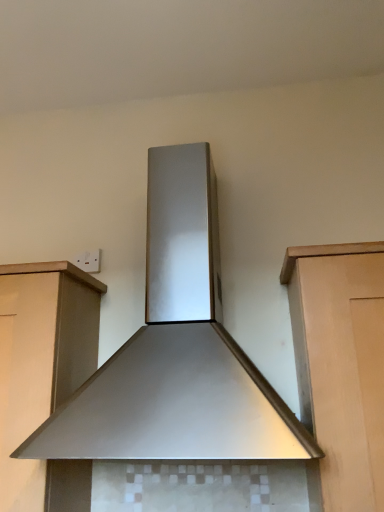
Question: Does matte wood cabinet at left come in front of stainless steel range hood at center?

Choices:
 (A) no
 (B) yes

Answer: (A)

Question: Would you say matte wood cabinet at left is outside stainless steel range hood at center?

Choices:
 (A) no
 (B) yes

Answer: (B)

Question: Is matte wood cabinet at left smaller than stainless steel range hood at center?

Choices:
 (A) no
 (B) yes

Answer: (B)

Question: Does matte wood cabinet at left have a greater height compared to stainless steel range hood at center?

Choices:
 (A) yes
 (B) no

Answer: (B)

Question: Is matte wood cabinet at left shorter than stainless steel range hood at center?

Choices:
 (A) yes
 (B) no

Answer: (A)

Question: Is stainless steel range hood at center at the back of matte wood cabinet at left?

Choices:
 (A) no
 (B) yes

Answer: (A)

Question: Are stainless steel range hood at center and matte wood cabinet at left beside each other?

Choices:
 (A) yes
 (B) no

Answer: (B)

Question: Is stainless steel range hood at center shorter than matte wood cabinet at left?

Choices:
 (A) no
 (B) yes

Answer: (A)

Question: Is stainless steel range hood at center bigger than matte wood cabinet at left?

Choices:
 (A) yes
 (B) no

Answer: (A)

Question: Can we say stainless steel range hood at center lies outside matte wood cabinet at left?

Choices:
 (A) yes
 (B) no

Answer: (A)

Question: Considering the relative sizes of stainless steel range hood at center and matte wood cabinet at left in the image provided, is stainless steel range hood at center smaller than matte wood cabinet at left?

Choices:
 (A) no
 (B) yes

Answer: (A)

Question: Does stainless steel range hood at center come behind matte wood cabinet at left?

Choices:
 (A) yes
 (B) no

Answer: (B)

Question: From a real-world perspective, relative to matte wood cabinet at left, is stainless steel range hood at center vertically above or below?

Choices:
 (A) below
 (B) above

Answer: (B)